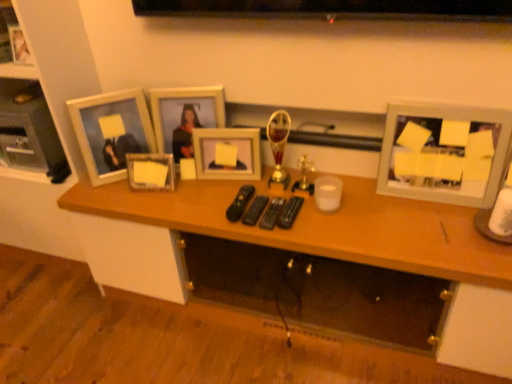
Question: From the image's perspective, is white matte picture frame at upper left, the second picture frame viewed from the left, positioned above or below black plastic remote at center, arranged as the fourth remote control when viewed from the right?

Choices:
 (A) below
 (B) above

Answer: (B)

Question: Does point (98, 99) appear closer or farther from the camera than point (226, 215)?

Choices:
 (A) closer
 (B) farther

Answer: (B)

Question: Which object is the closest to the black plastic remote at center, positioned as the 1th remote control in left-to-right order?

Choices:
 (A) white matte picture frame at upper left, arranged as the fifth picture frame when viewed from the right
 (B) wooden photo frame at center, which is counted as the 4th picture frame, starting from the left
 (C) wooden desk at center
 (D) matte glass picture frame at center, positioned as the second picture frame in right-to-left order
 (E) matte silver picture frame at upper left, which ranks as the 6th picture frame in right-to-left order

Answer: (D)

Question: Which object is positioned farthest from the black plastic remote control at center, placed as the fourth remote control when sorted from left to right?

Choices:
 (A) wooden picture frame at center, which is the third picture frame in left-to-right order
 (B) black plastic remote control at center, which appears as the 2th remote control when viewed from the left
 (C) white matte picture frame at upper right, which ranks as the 1th picture frame in right-to-left order
 (D) white matte picture frame at upper left, arranged as the fifth picture frame when viewed from the right
 (E) matte silver picture frame at upper left, which ranks as the 6th picture frame in right-to-left order

Answer: (E)